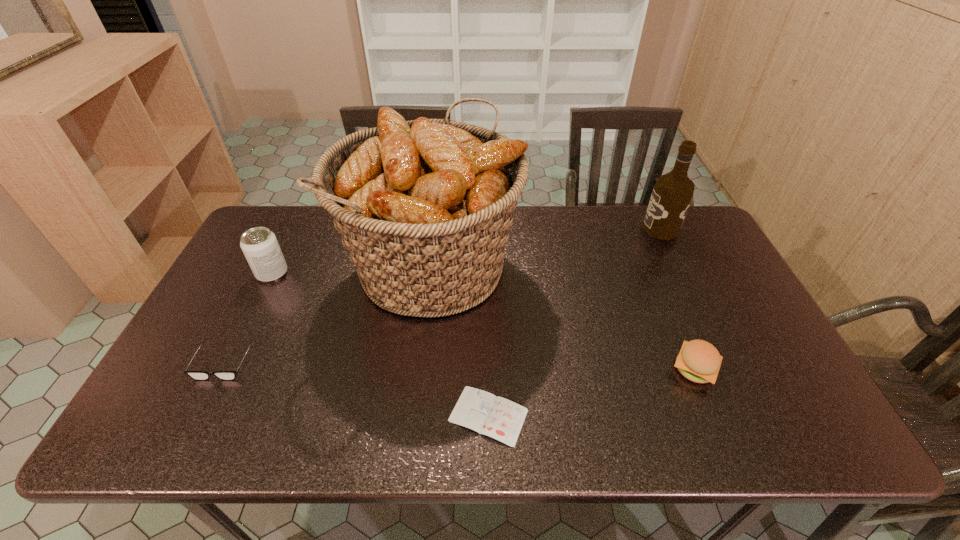
This screenshot has height=540, width=960. Identify the location of vacant space that's between the hamburger and the alcohol. (678, 299).

You are a GUI agent. You are given a task and a screenshot of the screen. Output one action in this format:
    pyautogui.click(x=<x>, y=<y>)
    Task: Click on the unoccupied position between the hamburger and the basket
    
    Given the screenshot: What is the action you would take?
    pyautogui.click(x=564, y=316)

Locate an element on the screen. This screenshot has height=540, width=960. free space that is in between the third shortest object and the tallest object is located at coordinates (564, 316).

Identify the location of vacant space that is in between the fourth tallest object and the alcohol. Image resolution: width=960 pixels, height=540 pixels. (678, 299).

Locate an element on the screen. blank region between the fourth tallest object and the alcohol is located at coordinates (678, 299).

Identify the location of the third closest object to the alcohol. Image resolution: width=960 pixels, height=540 pixels. (499, 418).

Where is `the closest object to the tallest object`? the closest object to the tallest object is located at coordinates (499, 418).

Find the location of a particular element. The image size is (960, 540). blank space that satisfies the following two spatial constraints: 1. on the back side of the shortest object; 2. on the left side of the hamburger is located at coordinates (488, 369).

Where is `free spot that satisfies the following two spatial constraints: 1. on the front-facing side of the diary; 2. on the right side of the spectacles`? The width and height of the screenshot is (960, 540). free spot that satisfies the following two spatial constraints: 1. on the front-facing side of the diary; 2. on the right side of the spectacles is located at coordinates (198, 415).

Identify the location of free location that satisfies the following two spatial constraints: 1. on the label of the fifth shortest object; 2. on the front-facing side of the spectacles. The width and height of the screenshot is (960, 540). (725, 363).